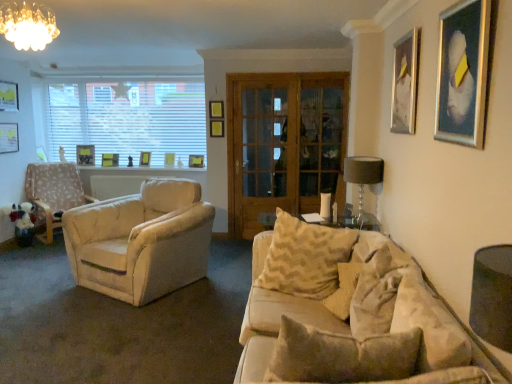
You are a GUI agent. You are given a task and a screenshot of the screen. Output one action in this format:
    pyautogui.click(x=<x>, y=<y>)
    Task: Click on the matte black picture frame at upper left, which is the 4th picture frame from front to back
    The image size is (512, 384).
    Given the screenshot: What is the action you would take?
    pyautogui.click(x=8, y=96)

In order to face green matte picture frame at upper center, marked as the fourth picture frame in a left-to-right arrangement, should I rotate leftwards or rightwards?

Turn left approximately 18.782 degrees to face it.

How much space does matte yellow picture frame at upper center, the fifth picture frame positioned from the back, occupy vertically?

matte yellow picture frame at upper center, the fifth picture frame positioned from the back, is 7.58 inches in height.

Identify the location of matte black picture frame at upper left, which ranks as the sixth picture frame in back-to-front order. (8, 96).

Is green matte picture frame at upper center, which is the eighth picture frame in front-to-back order, inside matte black picture frame at upper left, which is the ninth picture frame in right-to-left order?

No, green matte picture frame at upper center, which is the eighth picture frame in front-to-back order, is not a part of matte black picture frame at upper left, which is the ninth picture frame in right-to-left order.

Which object is thinner, matte black picture frame at upper left, which is the first picture frame from left to right, or green matte picture frame at upper center, which appears as the 6th picture frame when viewed from the right?

Thinner between the two is matte black picture frame at upper left, which is the first picture frame from left to right.

Is point (11, 99) in front of point (104, 159)?

That is True.

Considering the sizes of objects matte black picture frame at upper left, which is the first picture frame from left to right, and green matte picture frame at upper center, marked as the fourth picture frame in a left-to-right arrangement, in the image provided, who is taller, matte black picture frame at upper left, which is the first picture frame from left to right, or green matte picture frame at upper center, marked as the fourth picture frame in a left-to-right arrangement,?

matte black picture frame at upper left, which is the first picture frame from left to right, is taller.

Considering the sizes of objects matte black picture frame at upper left, which is the 3th picture frame from left to right, and matte yellow picture frame at upper center, which is the 5th picture frame in right-to-left order, in the image provided, who is shorter, matte black picture frame at upper left, which is the 3th picture frame from left to right, or matte yellow picture frame at upper center, which is the 5th picture frame in right-to-left order,?

matte yellow picture frame at upper center, which is the 5th picture frame in right-to-left order, is shorter.

Would you consider matte black picture frame at upper left, which is the 3th picture frame from left to right, to be distant from matte yellow picture frame at upper center, which is the 6th picture frame in front-to-back order?

That's not correct — matte black picture frame at upper left, which is the 3th picture frame from left to right, is a little close to matte yellow picture frame at upper center, which is the 6th picture frame in front-to-back order.

Is matte black picture frame at upper left, which is the 3th picture frame from left to right, spatially inside matte yellow picture frame at upper center, which ranks as the fourth picture frame in back-to-front order, or outside of it?

The correct answer is: outside.

Could you tell me if matte black picture frame at upper left, which is the 3th picture frame from left to right, is turned towards green matte picture frame at upper center, marked as the fourth picture frame in a left-to-right arrangement?

No, matte black picture frame at upper left, which is the 3th picture frame from left to right, does not turn towards green matte picture frame at upper center, marked as the fourth picture frame in a left-to-right arrangement.

Can you confirm if matte black picture frame at upper left, which ranks as the seventh picture frame in right-to-left order, is thinner than green matte picture frame at upper center, which appears as the 6th picture frame when viewed from the right?

No.

Which is further, (x=86, y=148) or (x=115, y=159)?

The point (x=115, y=159) is farther.

Can you confirm if matte yellow picture frame at upper center, the fifth picture frame positioned from the back, is shorter than matte black picture frame at upper left, which is the 4th picture frame from front to back?

Indeed, matte yellow picture frame at upper center, the fifth picture frame positioned from the back, has a lesser height compared to matte black picture frame at upper left, which is the 4th picture frame from front to back.

Considering the relative positions of matte yellow picture frame at upper center, the fifth picture frame positioned from the back, and matte black picture frame at upper left, which is the 4th picture frame from front to back, in the image provided, is matte yellow picture frame at upper center, the fifth picture frame positioned from the back, to the left of matte black picture frame at upper left, which is the 4th picture frame from front to back, from the viewer's perspective?

In fact, matte yellow picture frame at upper center, the fifth picture frame positioned from the back, is to the right of matte black picture frame at upper left, which is the 4th picture frame from front to back.

Do you think matte yellow picture frame at upper center, marked as the seventh picture frame in a left-to-right arrangement, is within matte black picture frame at upper left, which is the first picture frame from left to right, or outside of it?

matte yellow picture frame at upper center, marked as the seventh picture frame in a left-to-right arrangement, is spatially situated outside matte black picture frame at upper left, which is the first picture frame from left to right.

Which of these two, matte yellow picture frame at upper center, the fifth picture frame positioned from the back, or matte black picture frame at upper left, which is the first picture frame from left to right, is wider?

With larger width is matte yellow picture frame at upper center, the fifth picture frame positioned from the back.

What's the angular difference between textured beige pillow at center, which ranks as the second pillow in front-to-back order, and wooden glass door at center's facing directions?

74.6 degrees.

Is the position of textured beige pillow at center, which ranks as the second pillow in front-to-back order, more distant than that of wooden glass door at center?

No, textured beige pillow at center, which ranks as the second pillow in front-to-back order, is closer to the viewer.

Could you tell me if textured beige pillow at center, the 2th pillow positioned from the back, is turned towards wooden glass door at center?

No, textured beige pillow at center, the 2th pillow positioned from the back, does not turn towards wooden glass door at center.

Is textured beige pillow at center, the 2th pillow positioned from the back, wider or thinner than wooden glass door at center?

Considering their sizes, textured beige pillow at center, the 2th pillow positioned from the back, looks broader than wooden glass door at center.

Consider the image. Is wooden glass door at center far away from green matte picture frame at upper center, which appears as the 6th picture frame when viewed from the right?

Yes.

Locate an element on the screen. glass door located on the right of green matte picture frame at upper center, which appears as the 6th picture frame when viewed from the right is located at coordinates (283, 144).

Which of these two, wooden glass door at center or green matte picture frame at upper center, which appears as the 6th picture frame when viewed from the right, stands taller?

wooden glass door at center.

Is beige soft pillow at lower right, the 1th pillow when ordered from front to back, beside green matte picture frame at upper center, which appears as the 6th picture frame when viewed from the right?

beige soft pillow at lower right, the 1th pillow when ordered from front to back, and green matte picture frame at upper center, which appears as the 6th picture frame when viewed from the right, are not in contact.

From the image's perspective, relative to green matte picture frame at upper center, which appears as the 6th picture frame when viewed from the right, is beige soft pillow at lower right, the 1th pillow when ordered from front to back, above or below?

beige soft pillow at lower right, the 1th pillow when ordered from front to back, is situated lower than green matte picture frame at upper center, which appears as the 6th picture frame when viewed from the right, in the image.

Looking at this image, which of these two, beige soft pillow at lower right, acting as the third pillow starting from the back, or green matte picture frame at upper center, which appears as the 6th picture frame when viewed from the right, is smaller?

With smaller size is green matte picture frame at upper center, which appears as the 6th picture frame when viewed from the right.

Is beige soft pillow at lower right, acting as the third pillow starting from the back, aimed at green matte picture frame at upper center, marked as the fourth picture frame in a left-to-right arrangement?

No, beige soft pillow at lower right, acting as the third pillow starting from the back, is not oriented towards green matte picture frame at upper center, marked as the fourth picture frame in a left-to-right arrangement.

The height and width of the screenshot is (384, 512). Identify the location of the 3rd picture frame counting from the left side of the green matte picture frame at upper center, marked as the fourth picture frame in a left-to-right arrangement. (8, 96).

Starting from the matte black picture frame at upper left, which is the 3th picture frame from left to right, which picture frame is the 3rd one in front? Please provide its 2D coordinates.

[(145, 158)]

From the image, which object appears to be nearer to green matte picture frame at upper center, marked as the fourth picture frame in a left-to-right arrangement, textured beige pillow at center, the 2th pillow positioned from the back, or matte black picture frame at upper left, positioned as the 8th picture frame in right-to-left order?

matte black picture frame at upper left, positioned as the 8th picture frame in right-to-left order, is closer to green matte picture frame at upper center, marked as the fourth picture frame in a left-to-right arrangement.

Considering their positions, is matte wooden picture frame at center, which is counted as the third picture frame, starting from the back, positioned closer to green matte picture frame at upper center, arranged as the second picture frame when viewed from the back, than matte gold chandelier at upper left?

matte wooden picture frame at center, which is counted as the third picture frame, starting from the back, lies closer to green matte picture frame at upper center, arranged as the second picture frame when viewed from the back, than the other object.

Based on their spatial positions, is matte wooden picture frame at center, which is counted as the third picture frame, starting from the back, or textured beige pillow at center, which ranks as the second pillow in front-to-back order, further from matte yellow picture frame at upper center, which is the 6th picture frame in front-to-back order?

textured beige pillow at center, which ranks as the second pillow in front-to-back order.

Based on their spatial positions, is matte black picture frame at upper left, arranged as the third picture frame when viewed from the front, or matte black picture frame at upper left, which is the 3th picture frame from left to right, closer to textured beige pillow at center, which ranks as the second pillow in front-to-back order?

The object closer to textured beige pillow at center, which ranks as the second pillow in front-to-back order, is matte black picture frame at upper left, which is the 3th picture frame from left to right.

Considering their positions, is metallic silver picture frame at upper right, which is the 8th picture frame in left-to-right order, positioned closer to wooden glass door at center than matte yellow picture frame at upper center, which is the 6th picture frame in front-to-back order?

matte yellow picture frame at upper center, which is the 6th picture frame in front-to-back order, is closer to wooden glass door at center.

Which object lies further to the anchor point matte black picture frame at upper left, which ranks as the seventh picture frame in right-to-left order, beige textured pillow at center, which ranks as the 3th pillow in front-to-back order, or matte black picture frame at upper left, the 7th picture frame from the back?

beige textured pillow at center, which ranks as the 3th pillow in front-to-back order.

Estimate the real-world distances between objects in this image. Which object is further from black fabric lampshade at right, matte black picture frame at upper left, which is the 3th picture frame from left to right, or matte yellow picture frame at upper center, marked as the seventh picture frame in a left-to-right arrangement?

matte black picture frame at upper left, which is the 3th picture frame from left to right, lies further to black fabric lampshade at right than the other object.

When comparing their distances from matte black picture frame at upper left, which is the ninth picture frame in right-to-left order, does wooden glass door at center or matte black picture frame at upper left, positioned as the 8th picture frame in right-to-left order, seem further?

wooden glass door at center.

The image size is (512, 384). I want to click on chair between matte black picture frame at upper left, which is the 4th picture frame from front to back, and black fabric lampshade at right, in the horizontal direction, so click(54, 192).

Locate an element on the screen. The image size is (512, 384). pillow between suede beige couch at center and textured beige pillow at center, the 2th pillow positioned from the back, from front to back is located at coordinates (383, 288).

At what (x,y) coordinates should I click in order to perform the action: click on lamp between beige textured pillow at center, which ranks as the 3th pillow in front-to-back order, and matte yellow picture frame at upper center, the 5th picture frame viewed from the front, in the front-back direction. Please return your answer as a coordinate pair (x, y). This screenshot has width=512, height=384. Looking at the image, I should click on (362, 176).

Locate an element on the screen. The image size is (512, 384). glass door positioned between metallic silver picture frame at upper right, acting as the second picture frame starting from the front, and green matte picture frame at upper center, arranged as the second picture frame when viewed from the back, from near to far is located at coordinates (283, 144).